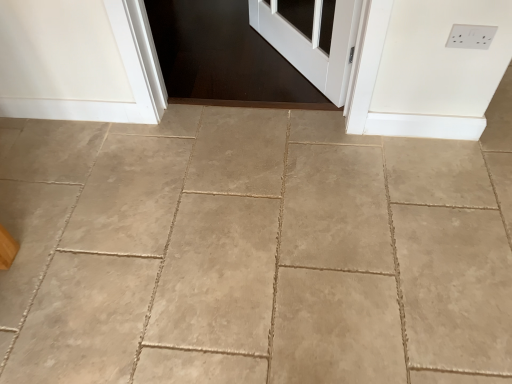
Question: From their relative heights in the image, would you say beige tile floor at center is taller or shorter than white plastic electric outlet at upper right?

Choices:
 (A) short
 (B) tall

Answer: (A)

Question: From the image's perspective, relative to white plastic electric outlet at upper right, is beige tile floor at center above or below?

Choices:
 (A) below
 (B) above

Answer: (A)

Question: From a real-world perspective, relative to white plastic electric outlet at upper right, is beige tile floor at center vertically above or below?

Choices:
 (A) above
 (B) below

Answer: (B)

Question: Based on their sizes in the image, would you say white plastic electric outlet at upper right is bigger or smaller than beige tile floor at center?

Choices:
 (A) big
 (B) small

Answer: (B)

Question: From a real-world perspective, is white plastic electric outlet at upper right physically located above or below beige tile floor at center?

Choices:
 (A) above
 (B) below

Answer: (A)

Question: Do you think white plastic electric outlet at upper right is within beige tile floor at center, or outside of it?

Choices:
 (A) inside
 (B) outside

Answer: (B)

Question: From the image's perspective, is white plastic electric outlet at upper right positioned above or below beige tile floor at center?

Choices:
 (A) above
 (B) below

Answer: (A)